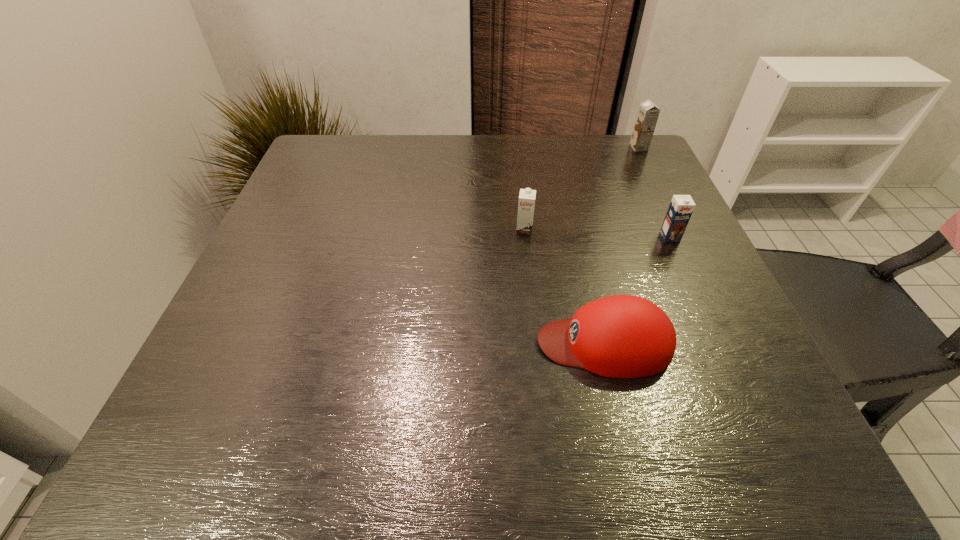
The height and width of the screenshot is (540, 960). What are the coordinates of `vacant space in between the leftmost chocolate milk and the baseball cap` in the screenshot? It's located at (564, 286).

This screenshot has height=540, width=960. I want to click on free spot between the tallest object and the baseball cap, so click(x=621, y=245).

I want to click on free space between the leftmost chocolate milk and the baseball cap, so click(564, 286).

The width and height of the screenshot is (960, 540). Find the location of `vacant region between the tallest chocolate milk and the leftmost chocolate milk`. vacant region between the tallest chocolate milk and the leftmost chocolate milk is located at coordinates (582, 188).

Image resolution: width=960 pixels, height=540 pixels. I want to click on free space between the leftmost chocolate milk and the nearest object, so click(564, 286).

Locate an element on the screen. This screenshot has height=540, width=960. object that ranks as the second closest to the leftmost chocolate milk is located at coordinates (681, 207).

Locate an element on the screen. Image resolution: width=960 pixels, height=540 pixels. object that is the second closest to the tallest chocolate milk is located at coordinates (526, 204).

Identify the location of chocolate milk that can be found as the second closest to the tallest object. Image resolution: width=960 pixels, height=540 pixels. (526, 204).

At what (x,y) coordinates should I click in order to perform the action: click on chocolate milk that is the closest to the tallest object. Please return your answer as a coordinate pair (x, y). Looking at the image, I should click on [x=681, y=207].

Locate an element on the screen. This screenshot has height=540, width=960. vacant area in the image that satisfies the following two spatial constraints: 1. on the back side of the farthest chocolate milk; 2. on the left side of the leftmost chocolate milk is located at coordinates (516, 147).